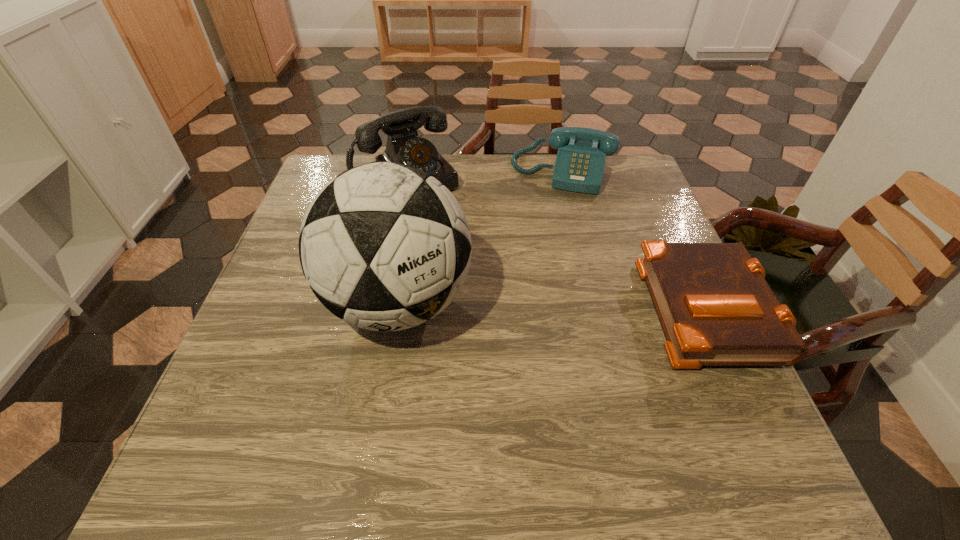
The image size is (960, 540). Identify the location of free space between the Bible and the taller telephone. (555, 244).

This screenshot has width=960, height=540. What are the coordinates of `free area in between the soccer ball and the Bible` in the screenshot? It's located at (552, 305).

Where is `vacant space in between the shorter telephone and the shortest object`? The height and width of the screenshot is (540, 960). vacant space in between the shorter telephone and the shortest object is located at coordinates (634, 240).

Identify which object is the second closest to the third tallest object. Please provide its 2D coordinates. Your answer should be formatted as a tuple, i.e. [(x, y)], where the tuple contains the x and y coordinates of a point satisfying the conditions above.

[(714, 305)]

Choose which object is the third nearest neighbor to the shortest object. Please provide its 2D coordinates. Your answer should be formatted as a tuple, i.e. [(x, y)], where the tuple contains the x and y coordinates of a point satisfying the conditions above.

[(404, 146)]

This screenshot has height=540, width=960. In order to click on vacant region that satisfies the following two spatial constraints: 1. on the front side of the Bible; 2. on the spine side of the third shortest object in this screenshot , I will do `click(379, 307)`.

The height and width of the screenshot is (540, 960). What are the coordinates of `vacant space that satisfies the following two spatial constraints: 1. on the surface of the soccer ball where the brand logo is visible; 2. on the spine side of the shortest object` in the screenshot? It's located at (398, 307).

Locate an element on the screen. The image size is (960, 540). free space that satisfies the following two spatial constraints: 1. on the surface of the Bible where the brand logo is visible; 2. on the spine side of the soccer ball is located at coordinates (398, 307).

The height and width of the screenshot is (540, 960). I want to click on vacant space that satisfies the following two spatial constraints: 1. on the front side of the third tallest object; 2. on the spine side of the Bible, so click(x=595, y=307).

I want to click on free point that satisfies the following two spatial constraints: 1. on the surface of the soccer ball where the brand logo is visible; 2. on the spine side of the Bible, so click(x=398, y=307).